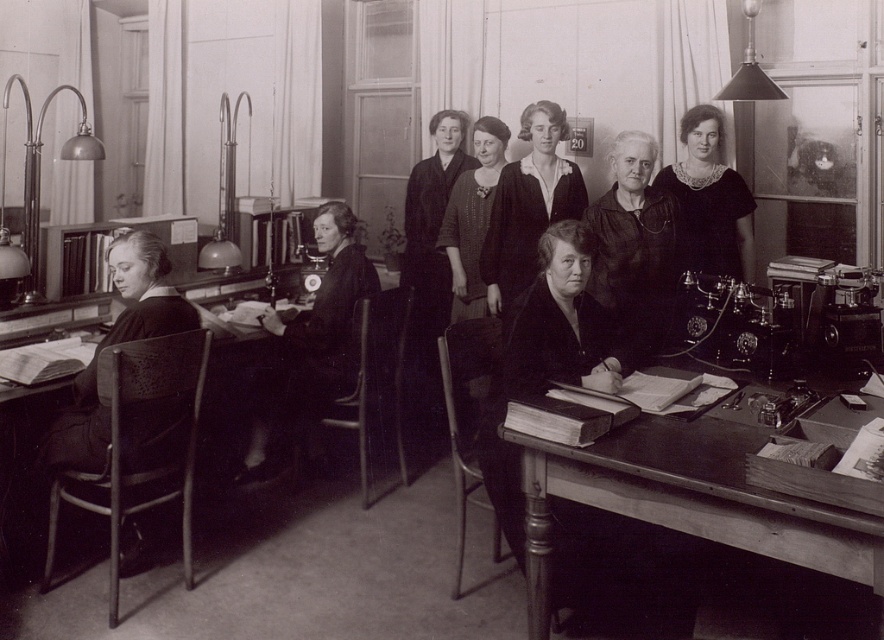
Question: Is matte black coat at center to the left of black velvet dress at upper right from the viewer's perspective?

Choices:
 (A) no
 (B) yes

Answer: (B)

Question: Among these points, which one is farthest from the camera?

Choices:
 (A) (338, 323)
 (B) (681, 420)
 (C) (543, 212)

Answer: (C)

Question: Does matte black coat at center have a lesser width compared to smooth black coat at center?

Choices:
 (A) yes
 (B) no

Answer: (A)

Question: Among these objects, which one is farthest from the camera?

Choices:
 (A) black velvet dress at upper right
 (B) wooden desk at lower right

Answer: (A)

Question: Is wooden desk at lower right wider than smooth black coat at center?

Choices:
 (A) yes
 (B) no

Answer: (A)

Question: Which object appears closest to the camera in this image?

Choices:
 (A) matte black dress at center
 (B) matte black coat at center
 (C) smooth black coat at center
 (D) black velvet dress at upper right

Answer: (B)